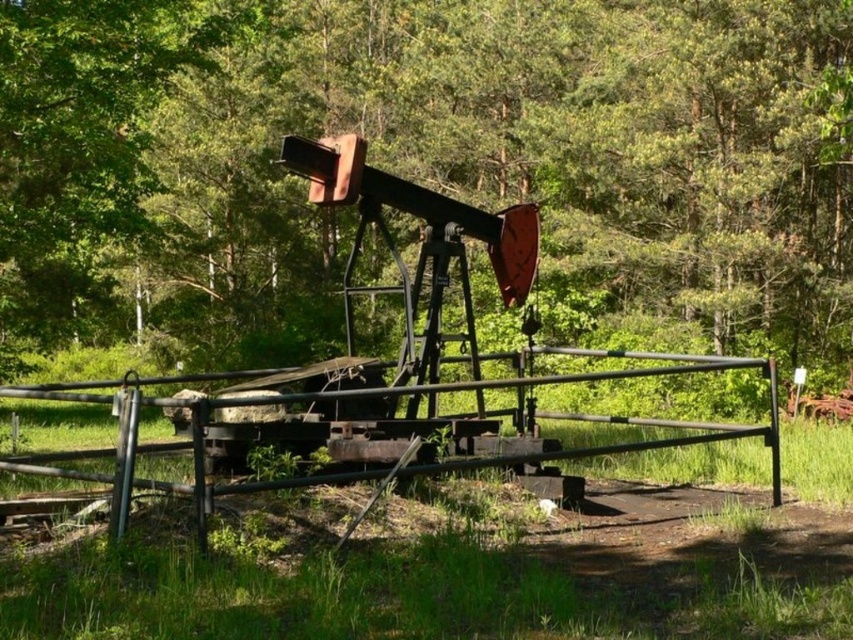
You are standing at the point marked as point (x=196, y=228) in the forest. You want to take a photo of the old, rusted oil pumpjack using a camera that has a maximum zoom range of 30 meters. Can you capture the pumpjack in your photo without moving closer?

The distance between point (x=196, y=228) and the camera is 32.85 meters. Since the camera can only zoom up to 30 meters, you cannot capture the pumpjack in the photo without moving closer.

You are a hiker navigating through the forest and come across the old oil pumpjack. You notice two points marked in the image. Which point, point (819, 172) or point (425, 472), is closer to your current position?

Point (819, 172) is further to the viewer than point (425, 472), so the closer point to your current position is point (425, 472).

You are standing in a forest and see the green leafy tree at center. If you want to reach the tree within 3 seconds, what is the minimum speed you need to walk at?

The green leafy tree at center is 12.02 meters away. To reach it in 3 seconds, you need to walk at a minimum speed of approximately 4.01 meters per second.